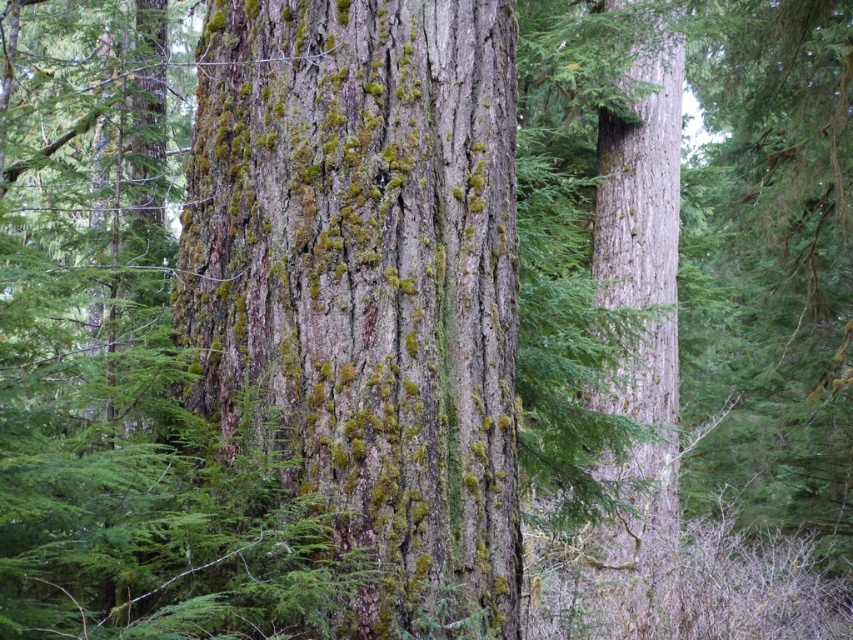
You are standing in front of a large tree trunk in a forest. You notice two points marked on the image at coordinates point (212, 44) and point (660, 88). Which point is nearer to your eyes?

Point (212, 44) is closer to the camera than point (660, 88), so the point (212, 44) is nearer to your eyes.

You are standing in a forest and want to touch both the green mossy bark at center and the smooth gray bark at right. Which one should you reach for first to touch the one closer to you?

The green mossy bark at center is closer to the viewer than smooth gray bark at right, so you should reach for the green mossy bark at center first.

You are a botanist studying tree bark textures. You observe the green mossy bark at center and the smooth gray bark at right in the image. Which of these two barks is positioned to the left?

The green mossy bark at center is positioned to the left of the smooth gray bark at right.